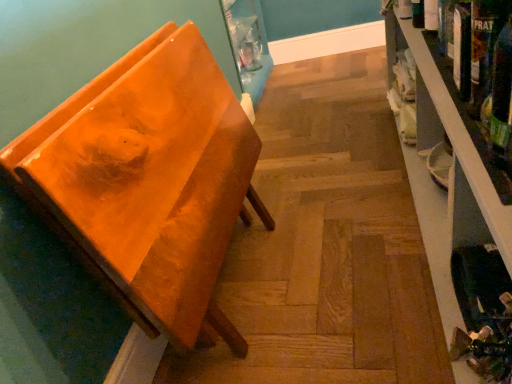
Question: Considering their positions, is wooden shelf at right located in front of or behind orange glossy chair at left?

Choices:
 (A) behind
 (B) front

Answer: (B)

Question: Considering the positions of wooden shelf at right and orange glossy chair at left in the image, is wooden shelf at right wider or thinner than orange glossy chair at left?

Choices:
 (A) thin
 (B) wide

Answer: (B)

Question: Estimate the real-world distances between objects in this image. Which object is closer to the orange glossy chair at left?

Choices:
 (A) green glass bottle at right
 (B) wooden shelf at right

Answer: (B)

Question: Estimate the real-world distances between objects in this image. Which object is closer to the wooden shelf at right?

Choices:
 (A) orange glossy chair at left
 (B) green glass bottle at right

Answer: (A)